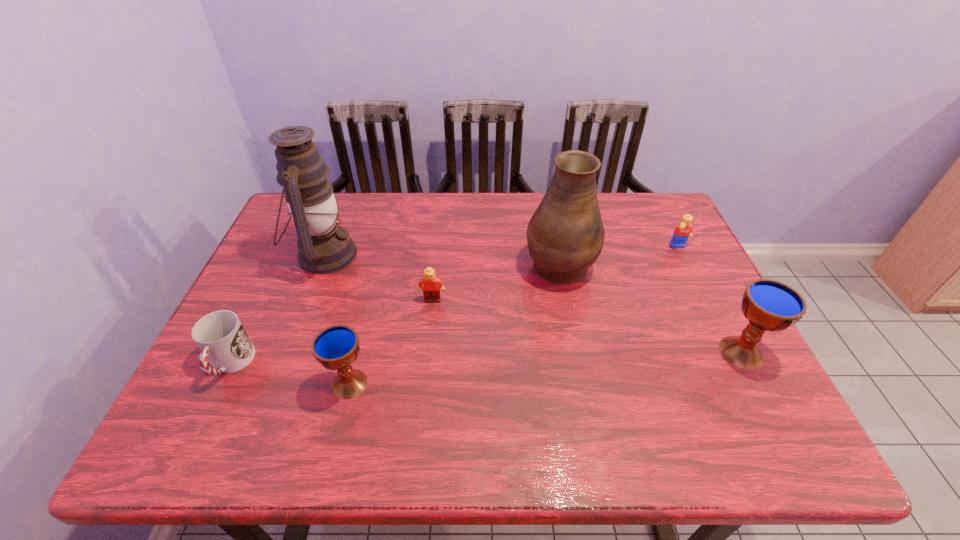
Where is `vacant region between the fifth object from left to right and the cup`? vacant region between the fifth object from left to right and the cup is located at coordinates (395, 314).

What are the coordinates of `object that is the fourth closest one to the cup` in the screenshot? It's located at (565, 235).

Locate which object is the fifth closest to the oil lamp. Please provide its 2D coordinates. Your answer should be formatted as a tuple, i.e. [(x, y)], where the tuple contains the x and y coordinates of a point satisfying the conditions above.

[(683, 231)]

This screenshot has height=540, width=960. Identify the location of vacant space that satisfies the following two spatial constraints: 1. on the face of the third tallest object; 2. on the right side of the right Lego. (732, 352).

The image size is (960, 540). Find the location of `vacant space that satisfies the following two spatial constraints: 1. on the face of the right chalice; 2. on the left side of the fourth object from right to left`. vacant space that satisfies the following two spatial constraints: 1. on the face of the right chalice; 2. on the left side of the fourth object from right to left is located at coordinates (427, 352).